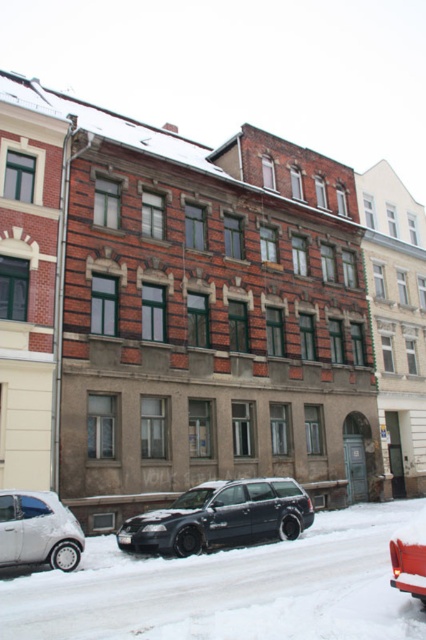
Question: Is white powdery snow at center above metallic silver car at lower right?

Choices:
 (A) yes
 (B) no

Answer: (B)

Question: Which is nearer to the metallic silver car at lower right?

Choices:
 (A) silver metallic car at lower left
 (B) white powdery snow at center
 (C) shiny black station wagon at center

Answer: (B)

Question: Which object is closer to the camera taking this photo?

Choices:
 (A) metallic silver car at lower right
 (B) white powdery snow at center
 (C) shiny black station wagon at center
 (D) silver metallic car at lower left

Answer: (B)

Question: Where is white powdery snow at center located in relation to silver metallic car at lower left in the image?

Choices:
 (A) below
 (B) above

Answer: (A)

Question: Which of the following is the closest to the observer?

Choices:
 (A) [16, 531]
 (B) [399, 545]
 (C) [106, 632]

Answer: (C)

Question: From the image, what is the correct spatial relationship of silver metallic car at lower left in relation to metallic silver car at lower right?

Choices:
 (A) above
 (B) below

Answer: (B)